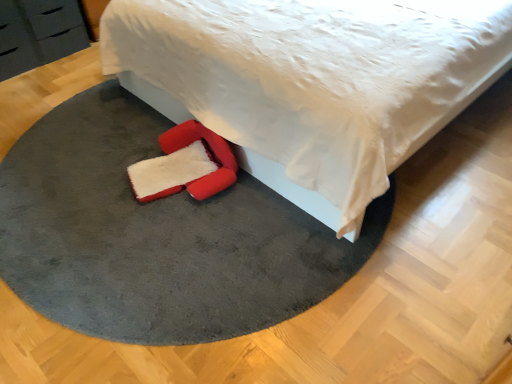
Find the location of a particular element. vacant space in front of velvet-like red footrest at lower center is located at coordinates (166, 251).